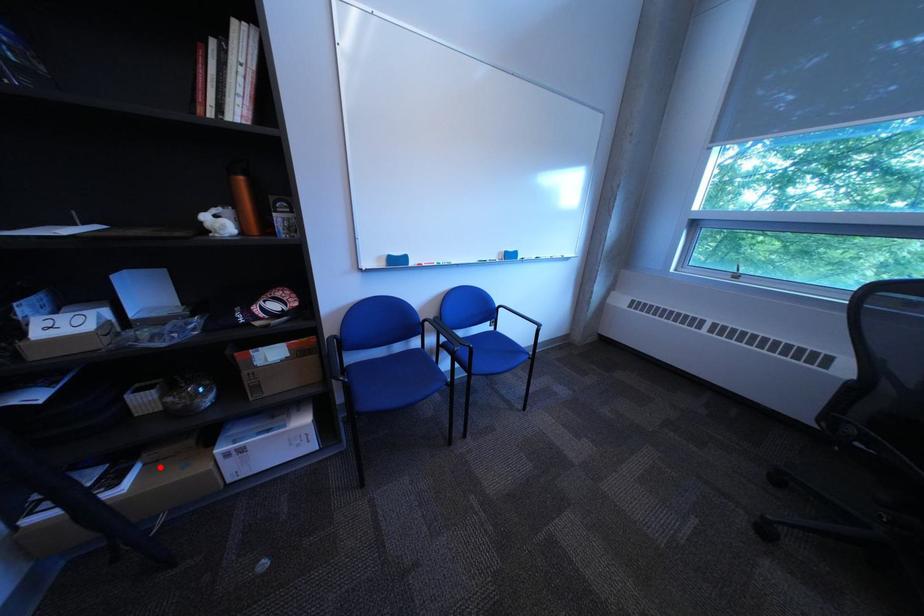
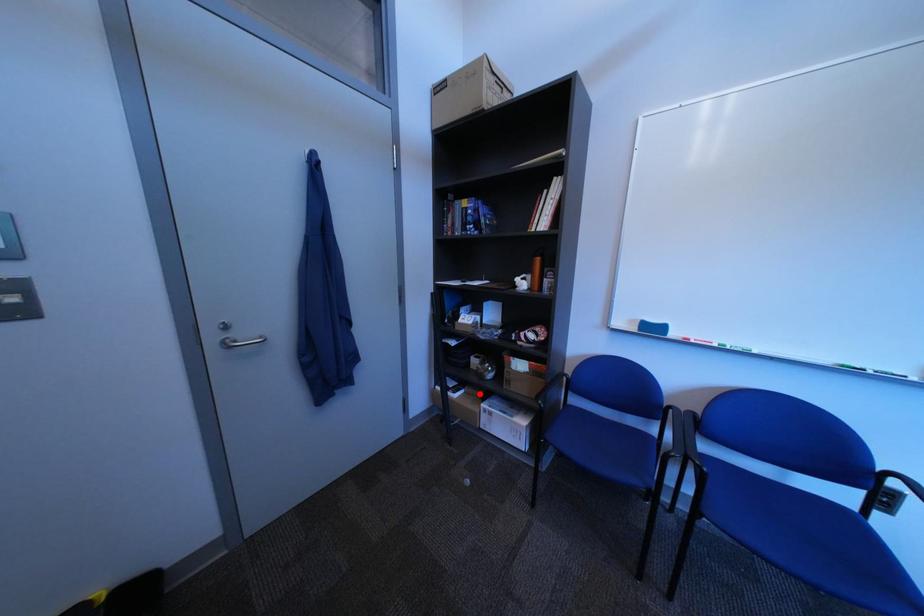
I am providing you with two images of the same scene from different viewpoints. A red point is marked on the first image and another point is marked on the second image. Does the point marked in image1 correspond to the same location as the one in image2?

Yes